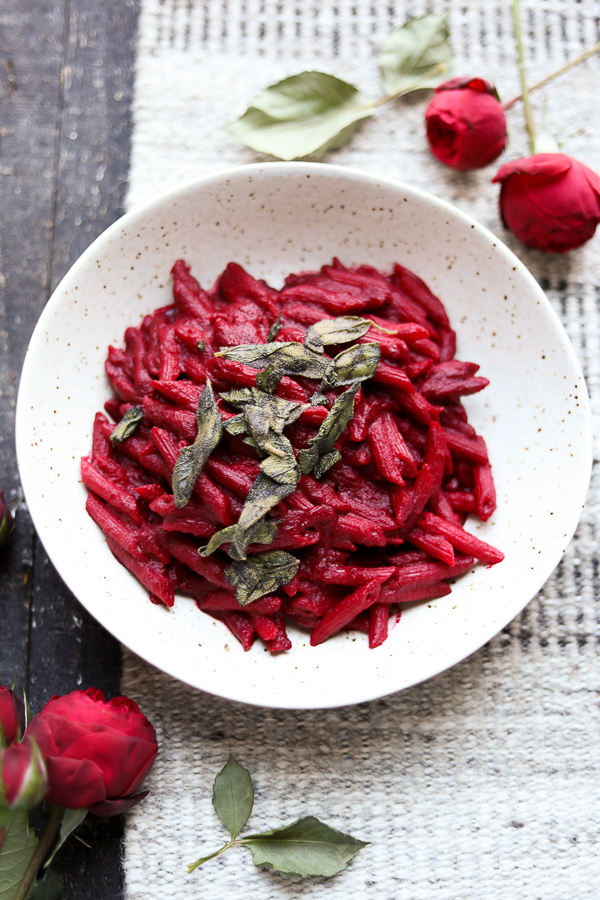
Identify the location of plate. (67, 527).